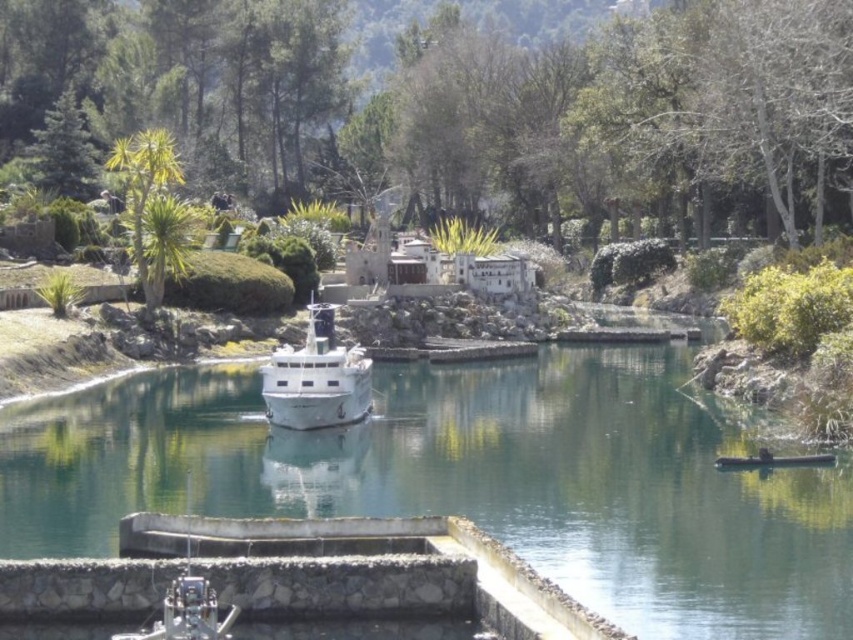
Question: Among these points, which one is nearest to the camera?

Choices:
 (A) (820, 141)
 (B) (331, 419)
 (C) (602, 602)
 (D) (123, 157)

Answer: (C)

Question: Is white glossy boat at center to the right of green leafy tree at upper left from the viewer's perspective?

Choices:
 (A) no
 (B) yes

Answer: (B)

Question: Can you confirm if green leafy tree at upper center is positioned to the right of white glossy boat at center?

Choices:
 (A) no
 (B) yes

Answer: (B)

Question: Can you confirm if white glossy boat at center is thinner than green leafy tree at upper left?

Choices:
 (A) yes
 (B) no

Answer: (A)

Question: Which point appears closest to the camera in this image?

Choices:
 (A) (828, 636)
 (B) (82, 140)
 (C) (288, 408)
 (D) (152, 248)

Answer: (A)

Question: Which point is closer to the camera?

Choices:
 (A) green leafy tree at upper left
 (B) white glossy boat at center

Answer: (B)